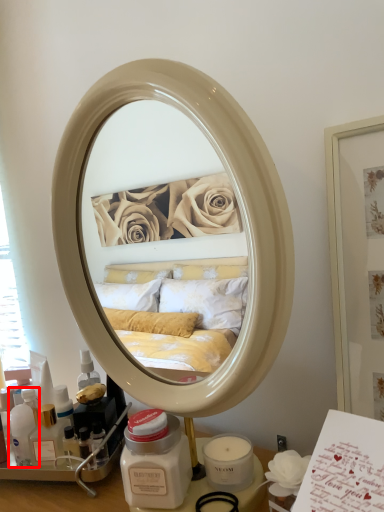
Question: In this image, where is toiletry (annotated by the red box) located relative to vanity?

Choices:
 (A) right
 (B) left

Answer: (B)